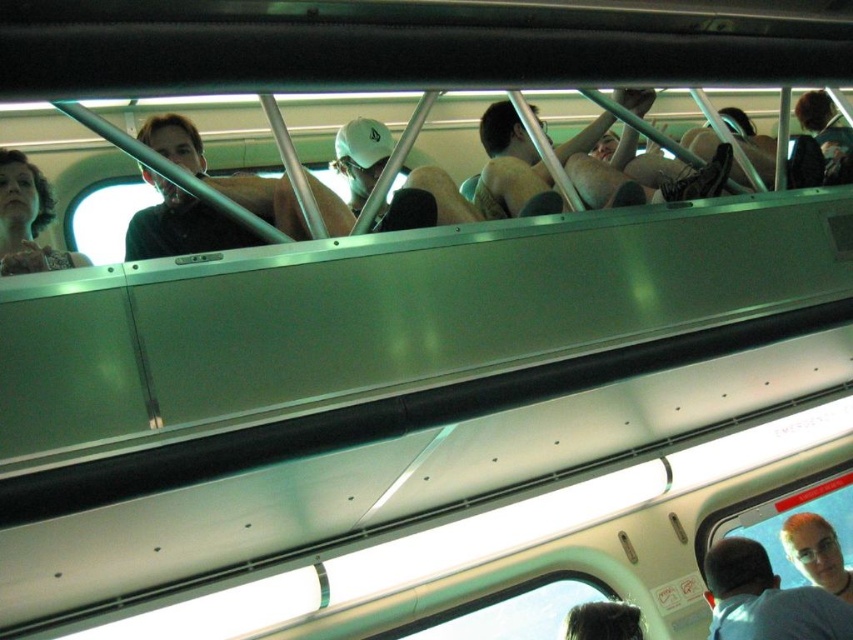
You are standing in the public transportation vehicle and want to reach the matte black hair at upper left without moving your feet. Can you touch it if you stretch your arm fully? Assume your arm is 0.7 meters long.

The distance between you and the matte black hair at upper left is 1.65 meters. Since your arm is only 0.7 meters long, you cannot reach it without moving your feet.

You are a passenger on the train and you notice two people with black hair. One has matte black hair at upper left and the other has shiny black hair at lower center. Which person has hair that is larger in size?

The matte black hair at upper left is bigger than the shiny black hair at lower center, so the person with matte black hair at upper left has larger hair.